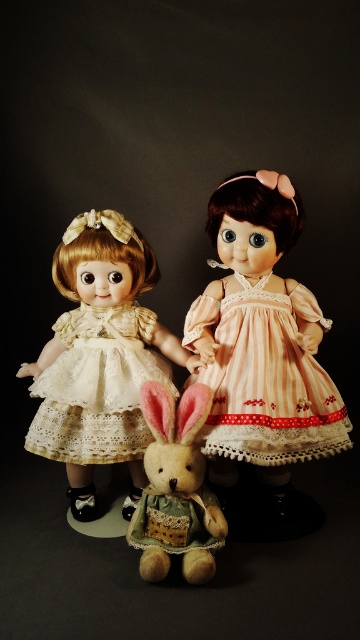
You are a fashion designer observing two dolls in an image. The dolls are wearing the matte cream lace dress at center and the pink striped fabric dress at center. Which dress appears taller on the doll?

The matte cream lace dress at center is taller than the pink striped fabric dress at center, so the matte cream lace dress at center appears taller on the doll.

You are an art restorer working on a vintage doll display. You need to place a decorative bow exactly at the center of the pink striped fabric dress at center. Given the coordinates provided, where should you place the bow?

The decorative bow should be placed at the coordinates point (266, 378), which is the 2D location of the pink striped fabric dress at center.